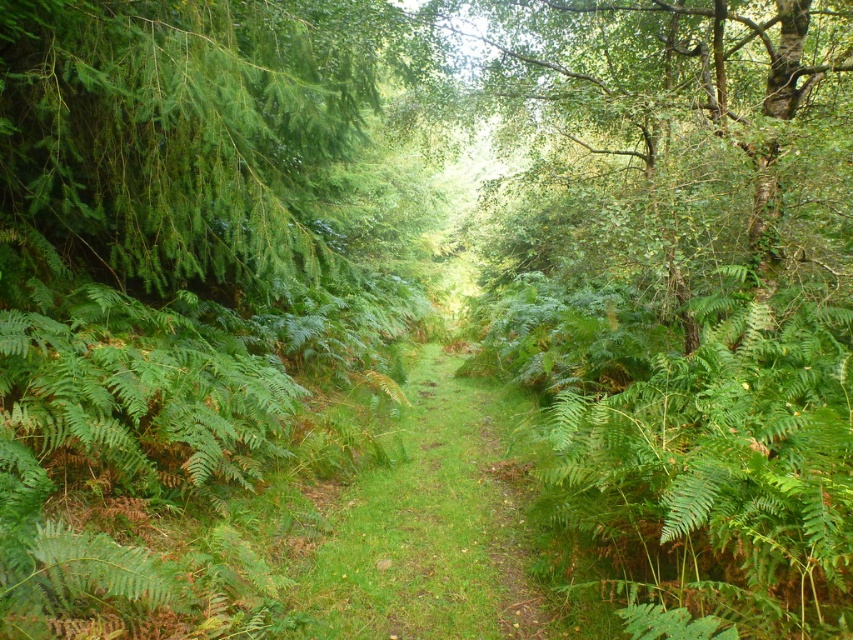
Is green leafy tree at left smaller than green grassy forest path at center?

Indeed, green leafy tree at left has a smaller size compared to green grassy forest path at center.

This screenshot has width=853, height=640. Describe the element at coordinates (196, 132) in the screenshot. I see `green leafy tree at left` at that location.

Where is `green leafy tree at left`? This screenshot has width=853, height=640. green leafy tree at left is located at coordinates (196, 132).